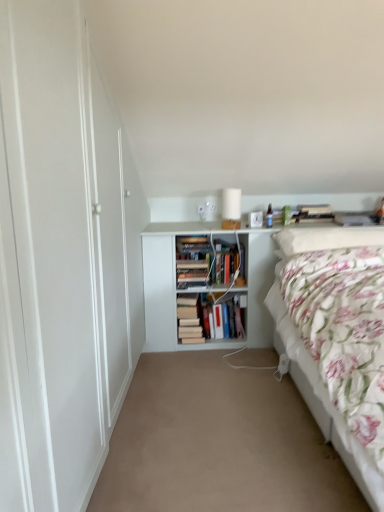
Question: Is hardcover books at center, the first book viewed from the left, to the left or to the right of hardcover book at center, arranged as the 2th book when viewed from the left, in the image?

Choices:
 (A) left
 (B) right

Answer: (A)

Question: From the image's perspective, is hardcover books at center, the first book viewed from the left, located above or below hardcover book at center, arranged as the 2th book when viewed from the left?

Choices:
 (A) above
 (B) below

Answer: (B)

Question: Considering the real-world distances, which object is farthest from the white glossy table lamp at center?

Choices:
 (A) hardcover book at center, the first book positioned from the right
 (B) floral cotton bed at right
 (C) white matte bookshelf at center
 (D) beige carpet at center
 (E) hardcover books at center, the first book viewed from the left

Answer: (D)

Question: Which of these objects is positioned closest to the white glossy table lamp at center?

Choices:
 (A) hardcover book at center, the first book positioned from the right
 (B) white matte bookshelf at center
 (C) floral cotton bed at right
 (D) hardcover books at center, the 2th book viewed from the right
 (E) fluffy white pillow at upper right

Answer: (B)